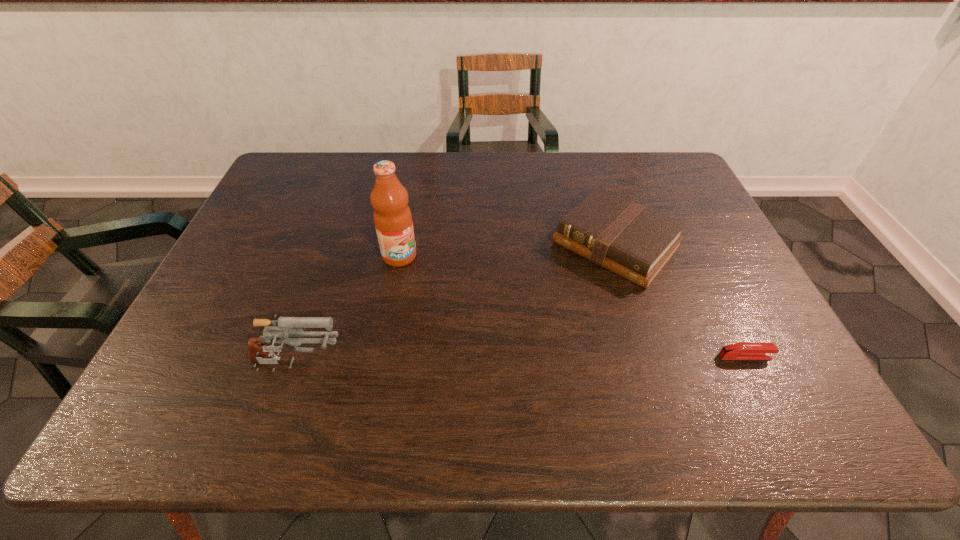
Image resolution: width=960 pixels, height=540 pixels. In order to click on vacant space located on the spine side of the Bible in this screenshot , I will do `click(550, 314)`.

Where is `vacant area situated on the spine side of the Bible`? This screenshot has height=540, width=960. vacant area situated on the spine side of the Bible is located at coordinates (567, 295).

You are a GUI agent. You are given a task and a screenshot of the screen. Output one action in this format:
    pyautogui.click(x=<x>, y=<y>)
    Task: Click on the blank area located 0.240m on the spine side of the Bible
    The width and height of the screenshot is (960, 540).
    Given the screenshot: What is the action you would take?
    pyautogui.click(x=528, y=337)

Find the location of a particular element. This screenshot has width=960, height=540. gun present at the near edge is located at coordinates (283, 328).

Locate an element on the screen. stapler present at the near edge is located at coordinates (744, 350).

The width and height of the screenshot is (960, 540). Find the location of `stapler located at the right edge`. stapler located at the right edge is located at coordinates (744, 350).

Identify the location of Bible located in the right edge section of the desktop. Image resolution: width=960 pixels, height=540 pixels. (634, 242).

Where is `object that is at the near right corner`? object that is at the near right corner is located at coordinates (744, 350).

The image size is (960, 540). In order to click on free space at the far edge in this screenshot , I will do `click(629, 165)`.

In order to click on vacant space at the near edge in this screenshot , I will do pyautogui.click(x=398, y=355).